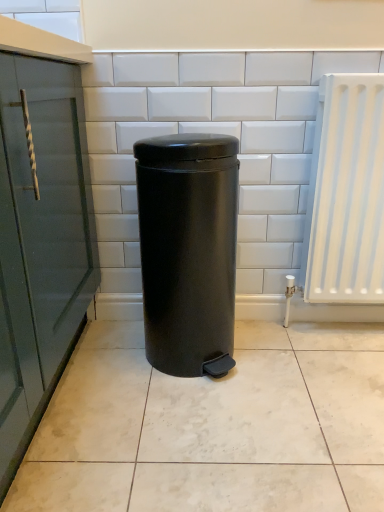
You are a GUI agent. You are given a task and a screenshot of the screen. Output one action in this format:
    pyautogui.click(x=<x>, y=<y>)
    Task: Click on the free space in front of matte black trash can at center
    
    Given the screenshot: What is the action you would take?
    pyautogui.click(x=193, y=423)